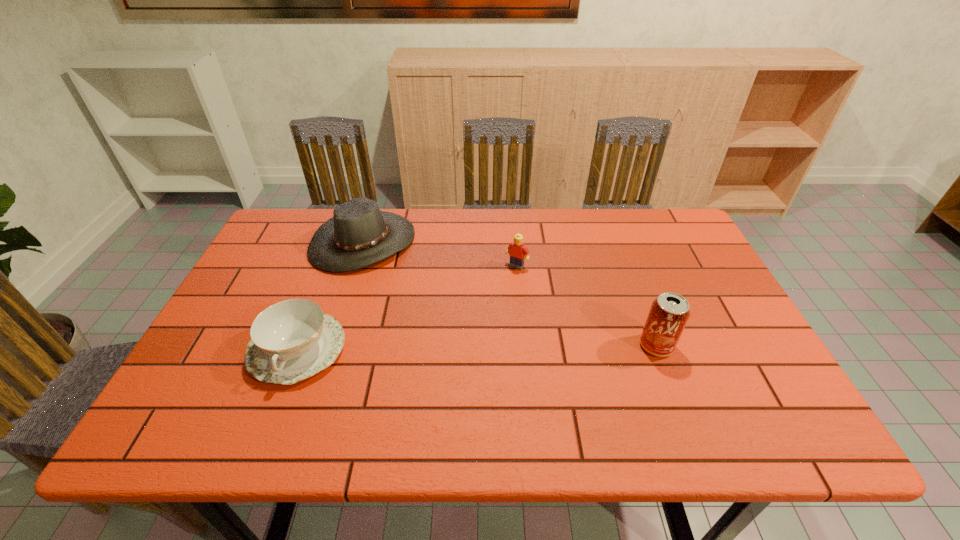
The width and height of the screenshot is (960, 540). I want to click on the shortest object, so click(292, 340).

I want to click on the tallest object, so click(669, 313).

Identify the location of soda can. (669, 313).

Find the location of `Lego`. Lego is located at coordinates (517, 250).

You are a GUI agent. You are given a task and a screenshot of the screen. Output one action in this format:
    pyautogui.click(x=<x>, y=<y>)
    Task: Click on the hat
    The height and width of the screenshot is (540, 960).
    Given the screenshot: What is the action you would take?
    pyautogui.click(x=359, y=234)

Locate an element on the screen. The height and width of the screenshot is (540, 960). free space located 0.280m on the left of the rightmost object is located at coordinates (522, 346).

Locate an element on the screen. The height and width of the screenshot is (540, 960). free space located on the front-facing side of the Lego is located at coordinates (469, 332).

Identify the location of vacant space situated 0.360m on the front-facing side of the Lego. (449, 361).

You are a GUI agent. You are given a task and a screenshot of the screen. Output one action in this format:
    pyautogui.click(x=<x>, y=<y>)
    Task: Click on the free space located 0.170m on the front-facing side of the Lego
    The height and width of the screenshot is (540, 960).
    Given the screenshot: What is the action you would take?
    pyautogui.click(x=485, y=308)

Identify the location of vacant space located 0.200m on the front-facing side of the hat. (437, 300).